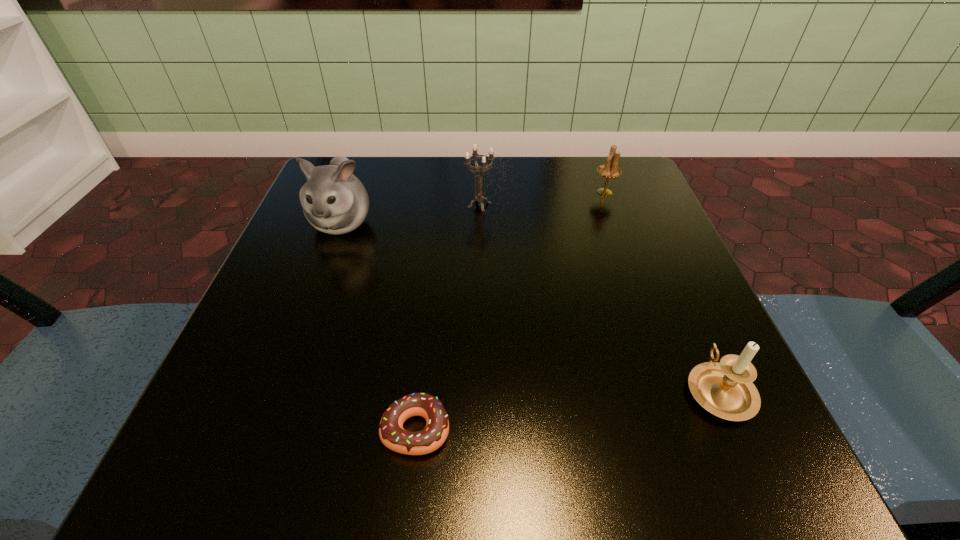
Where is `blank area at the near edge`? The width and height of the screenshot is (960, 540). blank area at the near edge is located at coordinates (562, 417).

This screenshot has width=960, height=540. In the image, there is a desktop. Find the location of `free space at the left edge`. free space at the left edge is located at coordinates (280, 261).

In the image, there is a desktop. Identify the location of vacant space at the right edge. (707, 355).

The height and width of the screenshot is (540, 960). I want to click on blank space at the far left corner of the desktop, so click(x=380, y=207).

Identify the location of blank area at the far right corner. This screenshot has width=960, height=540. (605, 185).

Identify the location of free spot between the leftmost candle holder and the second object from left to right. This screenshot has width=960, height=540. (447, 316).

At what (x,y) coordinates should I click in order to perform the action: click on free space that is in between the hamster and the nearest candle holder. Please return your answer as a coordinate pair (x, y). The width and height of the screenshot is (960, 540). Looking at the image, I should click on (530, 306).

Where is `vacant area that lies between the shortest object and the nearest candle holder`? vacant area that lies between the shortest object and the nearest candle holder is located at coordinates (567, 409).

Identify the location of free area in between the doughnut and the nearest candle holder. (567, 409).

You are a GUI agent. You are given a task and a screenshot of the screen. Output one action in this format:
    pyautogui.click(x=<x>, y=<y>)
    Task: Click on the free space between the nearest candle holder and the hamster
    The image size is (960, 540).
    Given the screenshot: What is the action you would take?
    pyautogui.click(x=530, y=306)